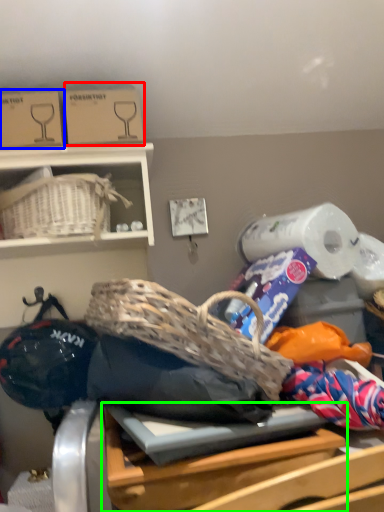
Question: Based on their relative distances, which object is nearer to cardboard box (highlighted by a red box)? Choose from cardboard box (highlighted by a blue box) and table (highlighted by a green box).

Choices:
 (A) cardboard box
 (B) table

Answer: (A)